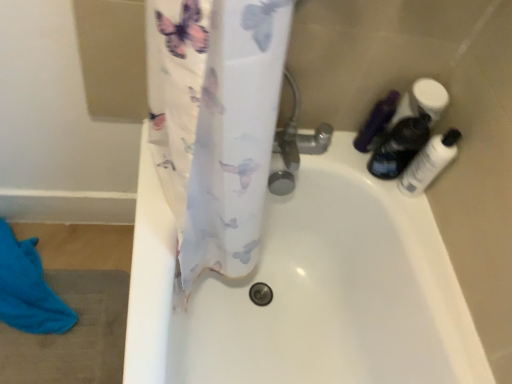
Question: Considering the positions of translucent plastic bottles at upper right, the 2th toiletry in the left-to-right sequence, and matte black bottle at upper right, the 1th toiletry from the left, in the image, is translucent plastic bottles at upper right, the 2th toiletry in the left-to-right sequence, taller or shorter than matte black bottle at upper right, the 1th toiletry from the left,?

Choices:
 (A) short
 (B) tall

Answer: (B)

Question: Based on their positions, is translucent plastic bottles at upper right, which is the 2th toiletry in right-to-left order, located to the left or right of matte black bottle at upper right, placed as the 3th toiletry when sorted from right to left?

Choices:
 (A) left
 (B) right

Answer: (B)

Question: Considering the real-world distances, which object is farthest from the blue cotton beach towel at lower left?

Choices:
 (A) matte black bottle at upper right, placed as the 3th toiletry when sorted from right to left
 (B) translucent plastic bottles at upper right, the 2th toiletry in the left-to-right sequence
 (C) transparent plastic bottle at right, marked as the 1th toiletry in a right-to-left arrangement

Answer: (C)

Question: Which object is the farthest from the translucent plastic bottles at upper right, the 2th toiletry in the left-to-right sequence?

Choices:
 (A) transparent plastic bottle at right, marked as the 1th toiletry in a right-to-left arrangement
 (B) blue cotton beach towel at lower left
 (C) matte black bottle at upper right, the 1th toiletry from the left

Answer: (B)